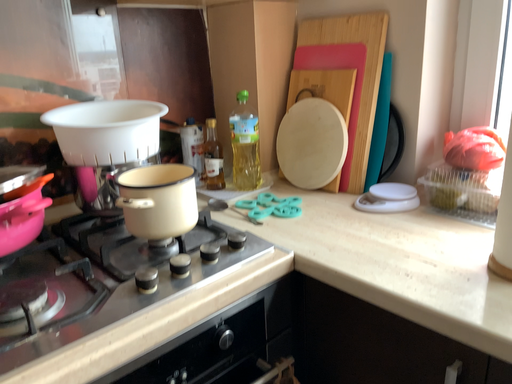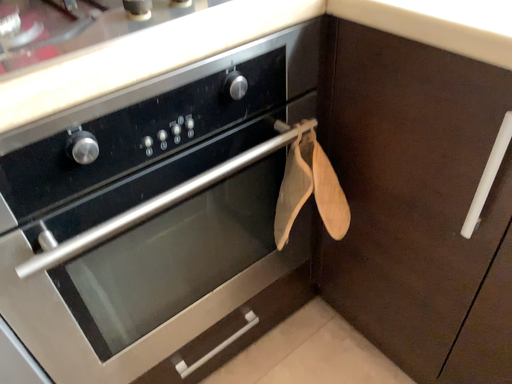
Question: How did the camera likely rotate when shooting the video?

Choices:
 (A) rotated upward
 (B) rotated downward

Answer: (B)